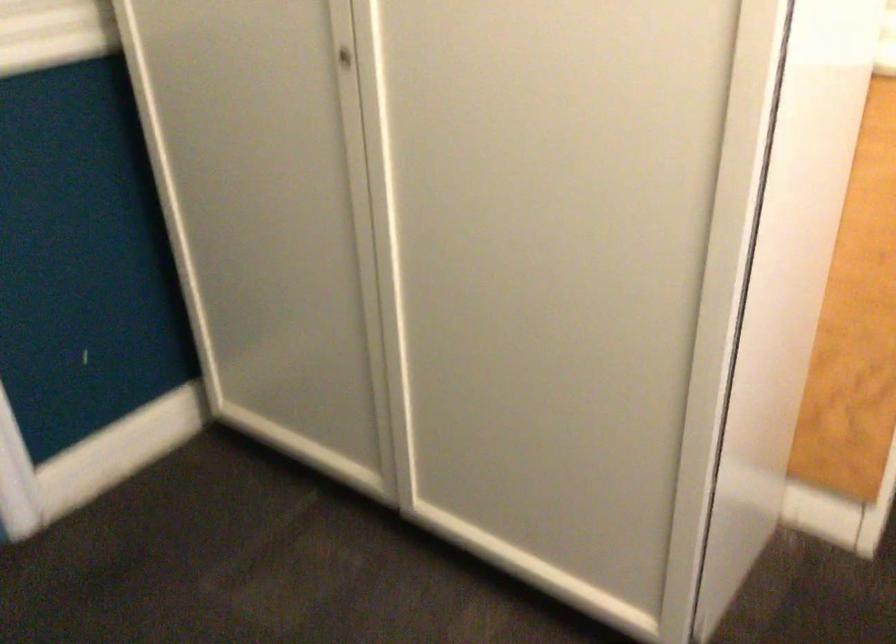
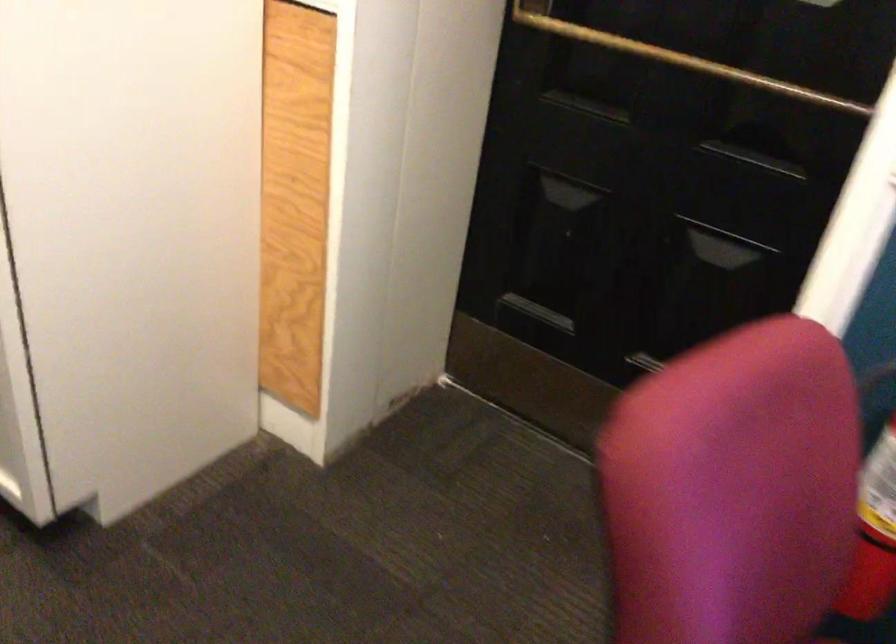
Question: How did the camera likely rotate?

Choices:
 (A) Left
 (B) Right
 (C) Up
 (D) Down

Answer: (B)